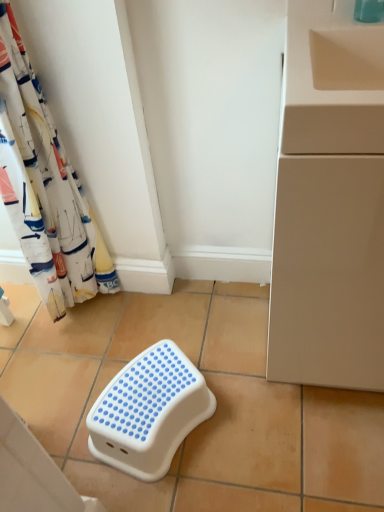
Locate an element on the screen. vacant space to the left of beige matte cabinet at right is located at coordinates (224, 349).